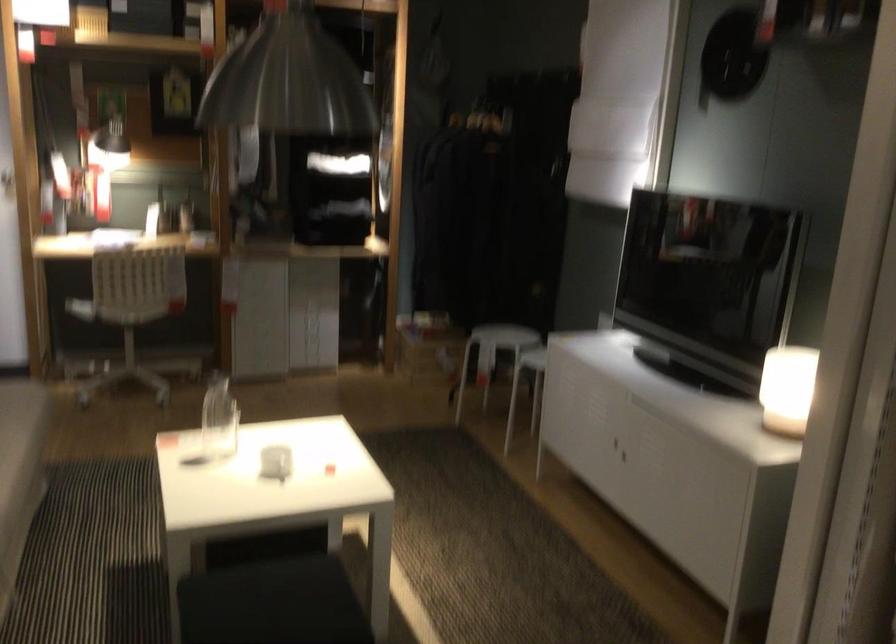
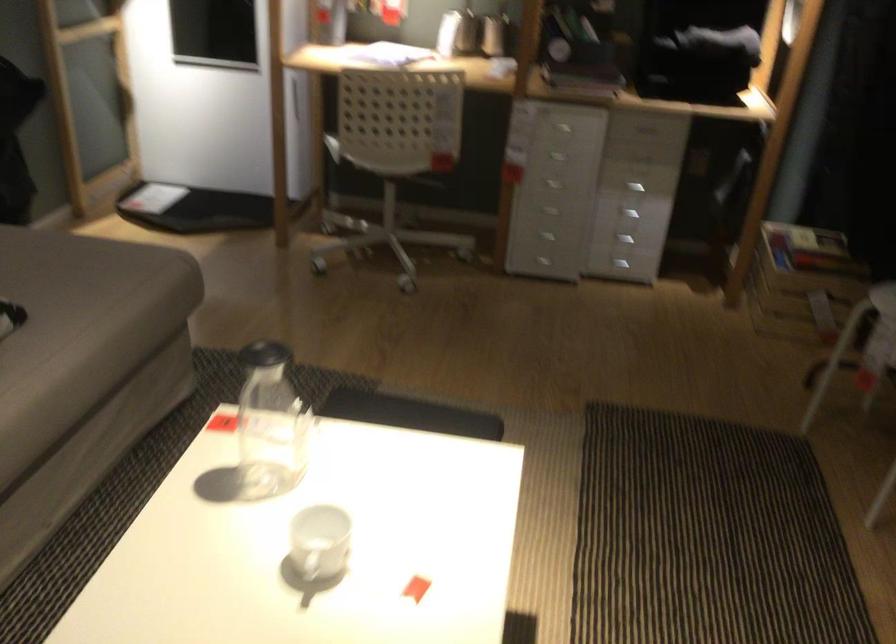
Where in the second image is the point corresponding to (x=309, y=323) from the first image?

(627, 214)